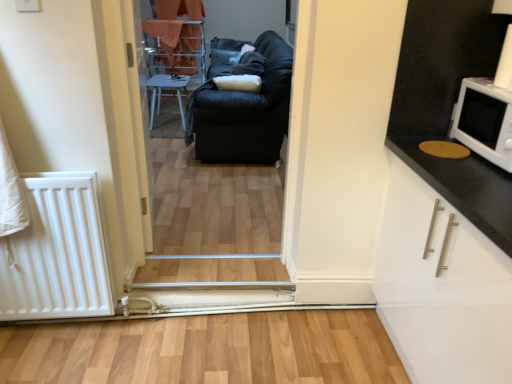
Question: From a real-world perspective, does white plastic chair at center stand above white glossy cabinet at right?

Choices:
 (A) yes
 (B) no

Answer: (B)

Question: Is white plastic chair at center not near white glossy cabinet at right?

Choices:
 (A) no
 (B) yes

Answer: (B)

Question: Are white plastic chair at center and white glossy cabinet at right making contact?

Choices:
 (A) yes
 (B) no

Answer: (B)

Question: From a real-world perspective, is white plastic chair at center physically below white glossy cabinet at right?

Choices:
 (A) yes
 (B) no

Answer: (A)

Question: From the image's perspective, is white plastic chair at center below white glossy cabinet at right?

Choices:
 (A) no
 (B) yes

Answer: (A)

Question: Does white plastic chair at center appear on the right side of white glossy cabinet at right?

Choices:
 (A) no
 (B) yes

Answer: (A)

Question: Is white glossy cabinet at right further to camera compared to black leather couch at center?

Choices:
 (A) yes
 (B) no

Answer: (B)

Question: Does white glossy cabinet at right turn towards black leather couch at center?

Choices:
 (A) yes
 (B) no

Answer: (B)

Question: Can black leather couch at center be found inside white glossy cabinet at right?

Choices:
 (A) no
 (B) yes

Answer: (A)

Question: From a real-world perspective, is white glossy cabinet at right located higher than black leather couch at center?

Choices:
 (A) no
 (B) yes

Answer: (A)

Question: Does white glossy cabinet at right have a lesser height compared to black leather couch at center?

Choices:
 (A) yes
 (B) no

Answer: (B)

Question: From the image's perspective, is white glossy cabinet at right under black leather couch at center?

Choices:
 (A) yes
 (B) no

Answer: (A)

Question: Considering the relative sizes of black leather couch at center and white glossy microwave at upper right in the image provided, is black leather couch at center thinner than white glossy microwave at upper right?

Choices:
 (A) yes
 (B) no

Answer: (A)